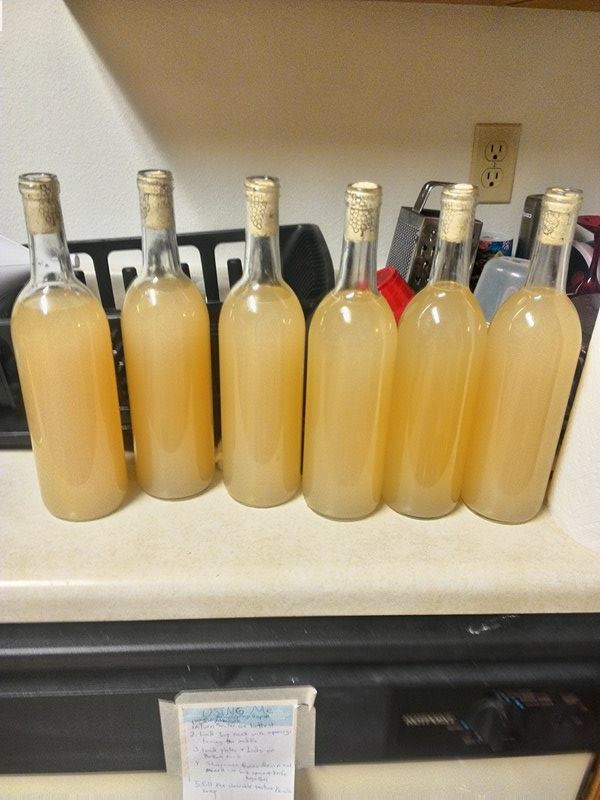
Where is `roll of white kitchen paper`? The image size is (600, 800). roll of white kitchen paper is located at coordinates point(583,496).